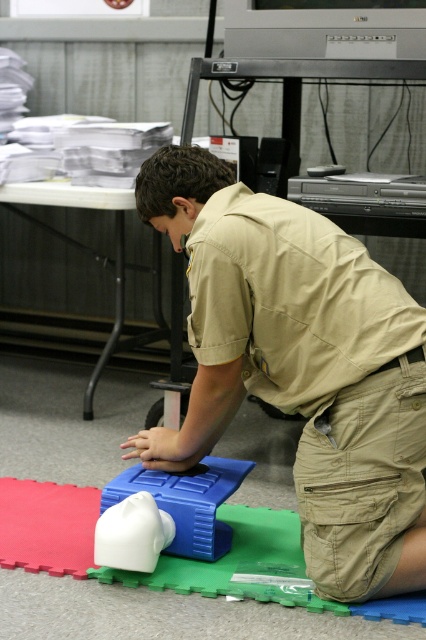
Based on the photo, you are a first responder assessing the scene. You see two points marked on the ground at coordinates point (218, 196) and point (178, 506). Which point is closer to the CPR training mannequin?

Point (218, 196) is in front of point (178, 506), so it is closer to the CPR training mannequin.

You are a first responder at a training exercise. You see a white rubber mannequin head at lower center and a white rubber toy at center. Which object is located above the other?

The white rubber mannequin head at lower center is positioned over the white rubber toy at center.